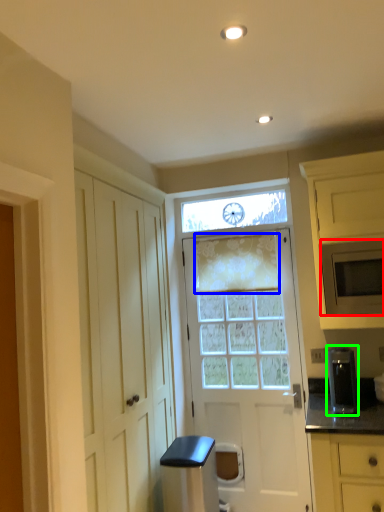
Question: Based on their relative distances, which object is farther from microwave oven (highlighted by a red box)? Choose from curtain (highlighted by a blue box) and appliance (highlighted by a green box).

Choices:
 (A) curtain
 (B) appliance

Answer: (A)